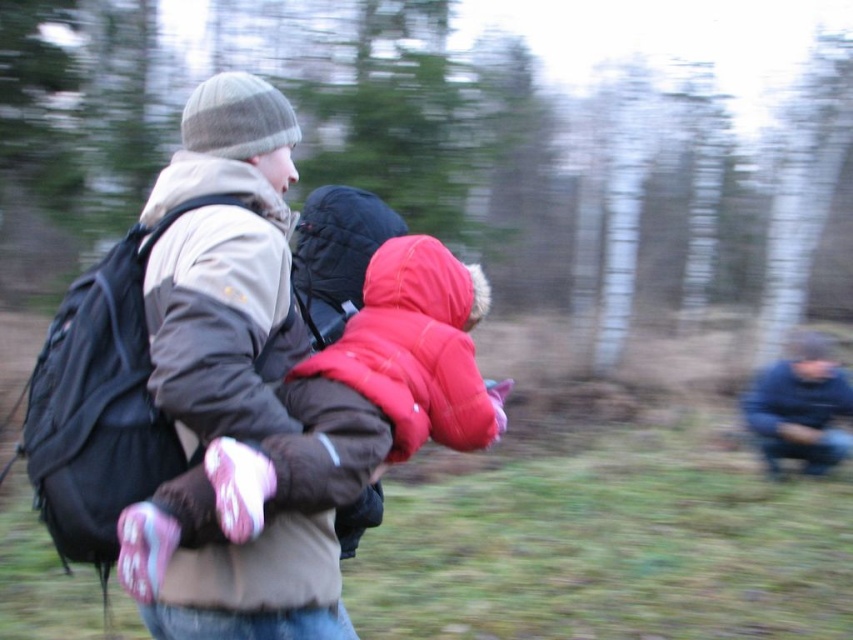
Question: Considering the real-world distances, which object is closest to the black fabric backpack at left?

Choices:
 (A) red fleece jacket at center
 (B) blue matte jacket at lower right
 (C) matte red jacket at center

Answer: (A)

Question: Does black fabric backpack at left appear over blue matte jacket at lower right?

Choices:
 (A) yes
 (B) no

Answer: (A)

Question: Is matte red jacket at center wider than blue matte jacket at lower right?

Choices:
 (A) no
 (B) yes

Answer: (A)

Question: Which point is farther to the camera?

Choices:
 (A) (103, 488)
 (B) (380, 310)
 (C) (387, 381)

Answer: (B)

Question: From the image, what is the correct spatial relationship of red fleece jacket at center in relation to black fabric backpack at left?

Choices:
 (A) right
 (B) left

Answer: (A)

Question: Which object is farther from the camera taking this photo?

Choices:
 (A) blue matte jacket at lower right
 (B) red fleece jacket at center
 (C) black fabric backpack at left

Answer: (A)